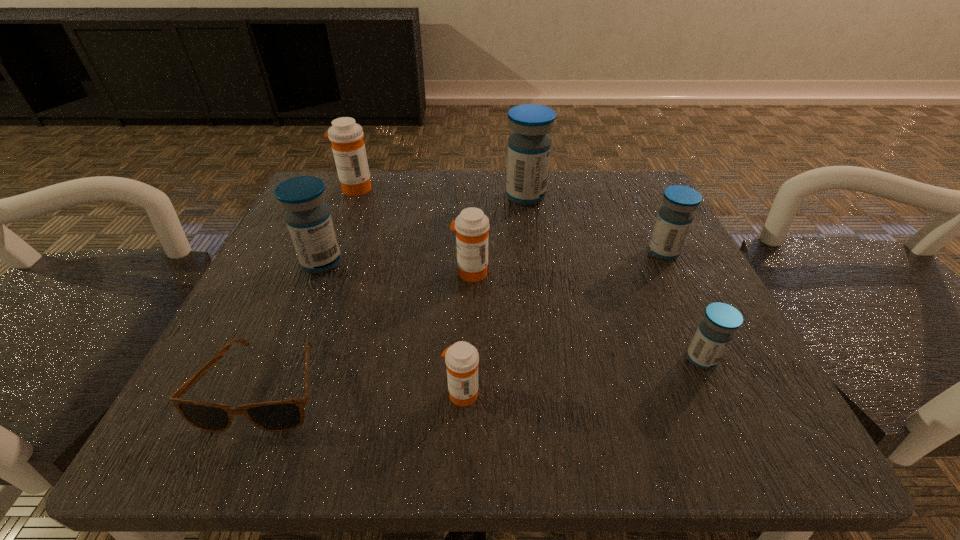
Image resolution: width=960 pixels, height=540 pixels. Identify the location of the tallest object. (529, 146).

Locate an element on the screen. The image size is (960, 540). the biggest blue medicine is located at coordinates (529, 146).

Identify the location of the leftmost orange medicine. This screenshot has width=960, height=540. (348, 147).

This screenshot has height=540, width=960. I want to click on the biggest orange medicine, so click(x=348, y=147).

This screenshot has height=540, width=960. What are the coordinates of `the leftmost blue medicine` in the screenshot? It's located at (308, 218).

Where is `the second smallest blue medicine`? This screenshot has width=960, height=540. the second smallest blue medicine is located at coordinates (675, 217).

At what (x,y) coordinates should I click in order to perform the action: click on the second nearest orange medicine. Please return your answer as a coordinate pair (x, y). This screenshot has width=960, height=540. Looking at the image, I should click on (472, 225).

You are a GUI agent. You are given a task and a screenshot of the screen. Output one action in this format:
    pyautogui.click(x=<x>, y=<y>)
    Task: Click on the second nearest medicine
    
    Given the screenshot: What is the action you would take?
    [716, 330]

Find the location of a particular element. This screenshot has height=540, width=960. the smallest blue medicine is located at coordinates (716, 330).

This screenshot has height=540, width=960. I want to click on the nearest orange medicine, so click(461, 359).